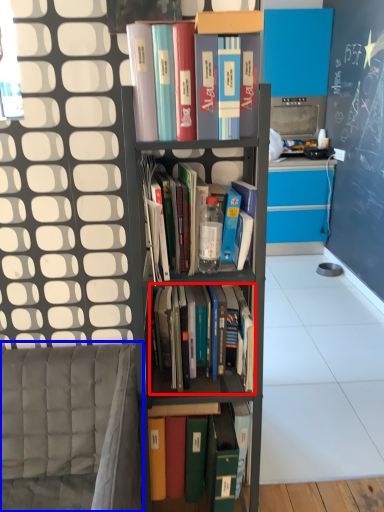
Question: Which point is further to the camera, book (highlighted by a red box) or armchair (highlighted by a blue box)?

Choices:
 (A) book
 (B) armchair

Answer: (A)